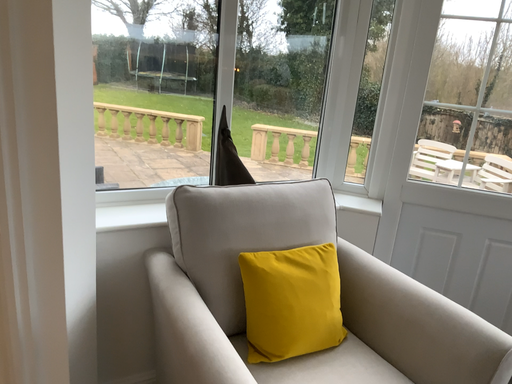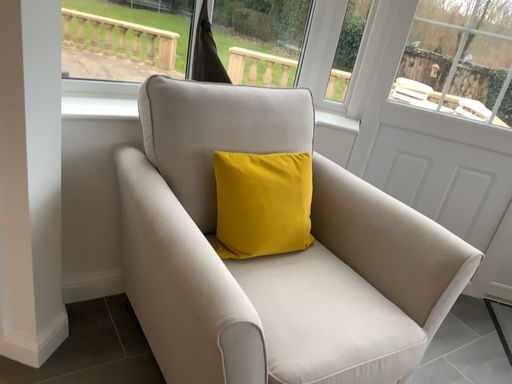
Question: Which way did the camera rotate in the video?

Choices:
 (A) rotated upward
 (B) rotated downward

Answer: (B)